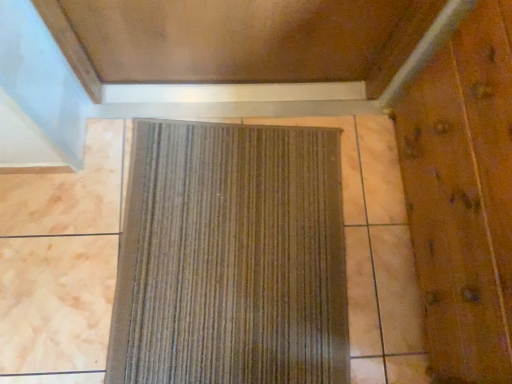
You are a GUI agent. You are given a task and a screenshot of the screen. Output one action in this format:
    pyautogui.click(x=<x>, y=<y>)
    Task: Click on the blank space above brown textured mat at center (from a real-world perspective)
    
    Given the screenshot: What is the action you would take?
    pyautogui.click(x=236, y=244)